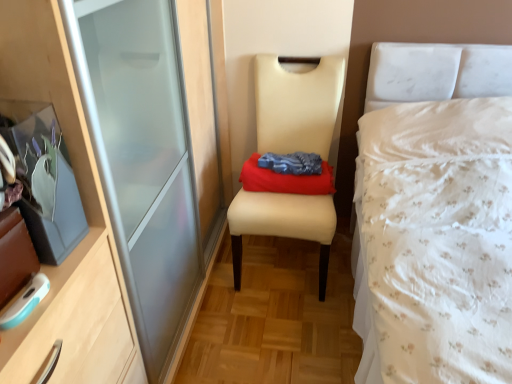
Question: Is white floral fabric bed at right taller or shorter than beige leather chair at center?

Choices:
 (A) short
 (B) tall

Answer: (B)

Question: Relative to beige leather chair at center, is white floral fabric bed at right in front or behind?

Choices:
 (A) front
 (B) behind

Answer: (A)

Question: Which object is the closest to the beige leather chair at center?

Choices:
 (A) white floral fabric bed at right
 (B) red cotton cloth at center

Answer: (B)

Question: Which object is positioned farthest from the beige leather chair at center?

Choices:
 (A) white floral fabric bed at right
 (B) red cotton cloth at center

Answer: (A)